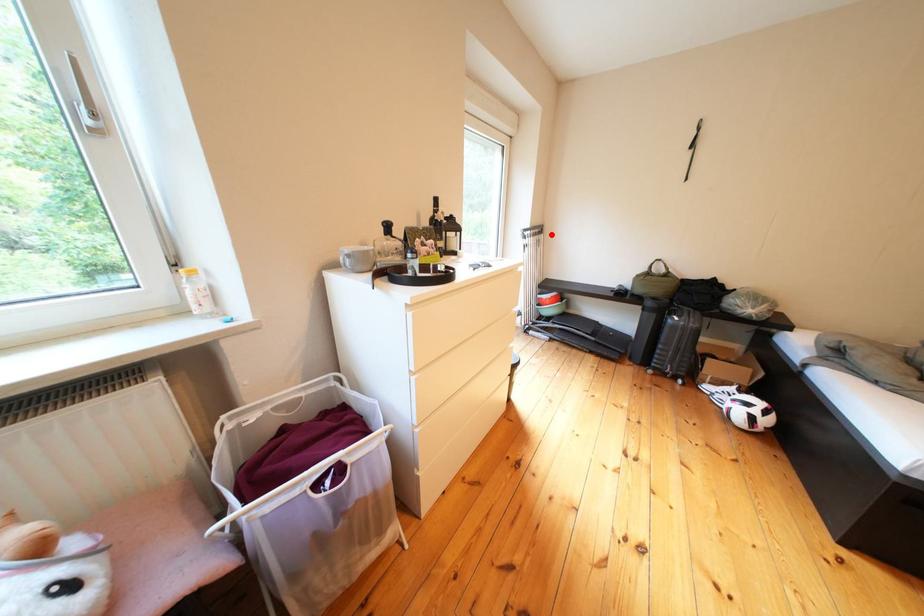
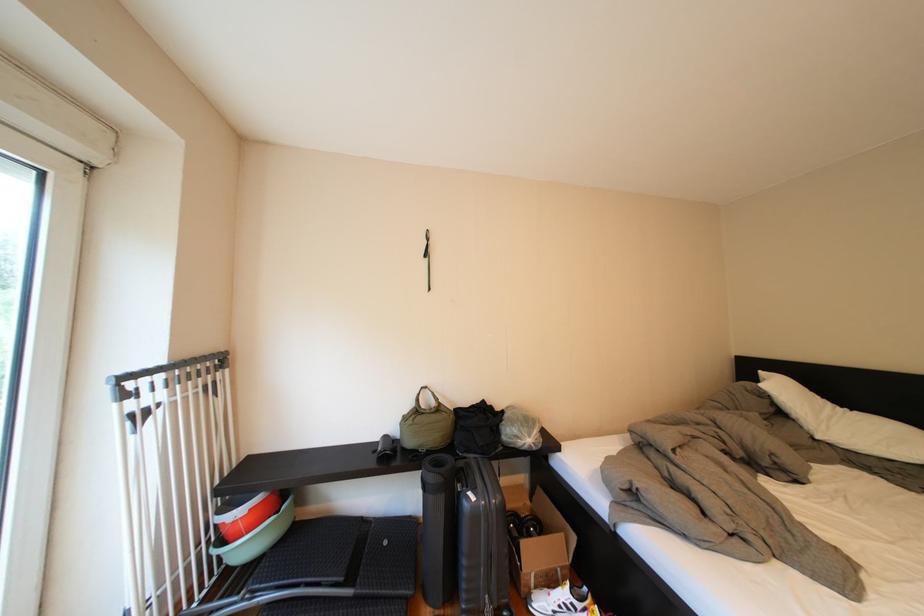
The point at the highlighted location is marked in the first image. Where is the corresponding point in the second image?

(224, 369)